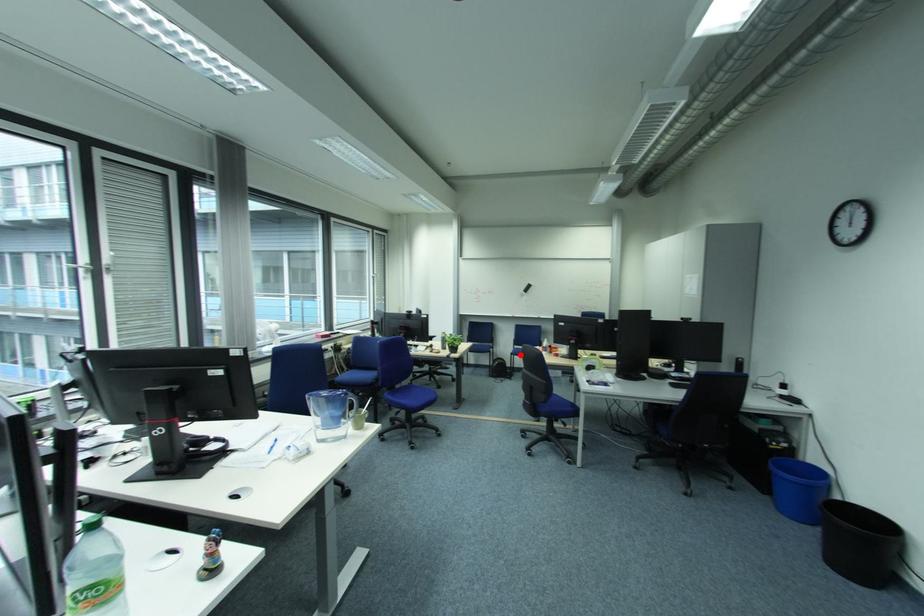
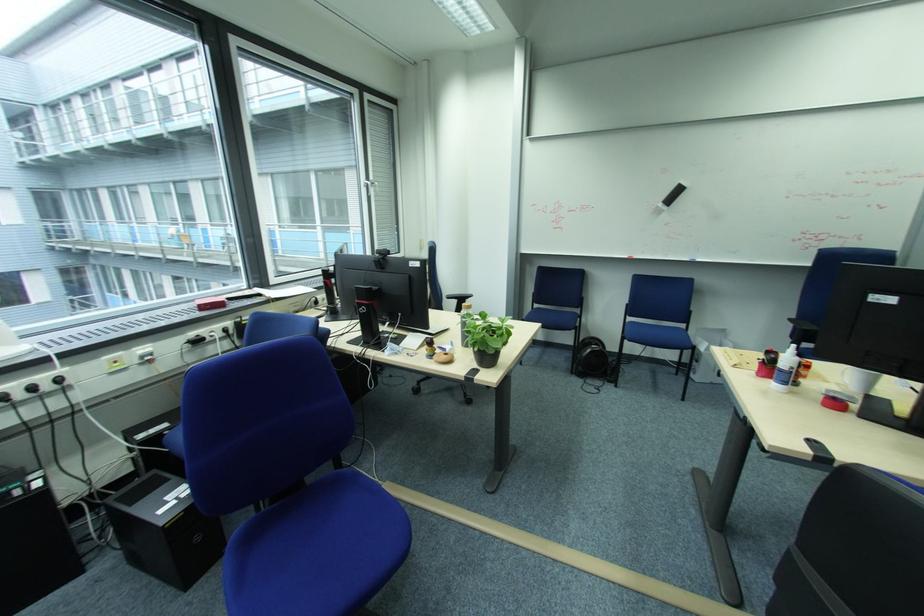
Question: I am providing you with two images of the same scene from different viewpoints. Given a red point in image1, look at the same physical point in image2. Is it:

Choices:
 (A) Closer to the viewpoint
 (B) Farther from the viewpoint

Answer: (A)